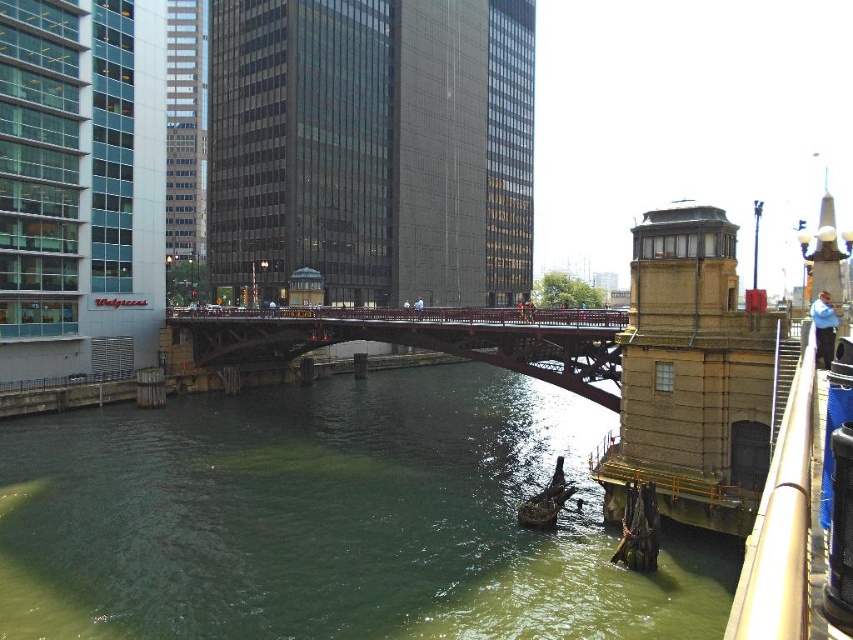
Between green murky water at center and rusty metal boat at lower center, which one appears on the right side from the viewer's perspective?

rusty metal boat at lower center is more to the right.

The image size is (853, 640). Describe the element at coordinates (329, 518) in the screenshot. I see `green murky water at center` at that location.

Is point (422, 432) closer to camera compared to point (525, 525)?

That is False.

Locate an element on the screen. Image resolution: width=853 pixels, height=640 pixels. green murky water at center is located at coordinates (329, 518).

Between red painted steel bridge at center and rusty metal boat at lower center, which one has more height?

With more height is red painted steel bridge at center.

From the picture: Between red painted steel bridge at center and rusty metal boat at lower center, which one appears on the left side from the viewer's perspective?

red painted steel bridge at center

The width and height of the screenshot is (853, 640). Describe the element at coordinates (422, 339) in the screenshot. I see `red painted steel bridge at center` at that location.

Locate an element on the screen. This screenshot has width=853, height=640. red painted steel bridge at center is located at coordinates [422, 339].

Does green murky water at center appear over red painted steel bridge at center?

No, green murky water at center is not above red painted steel bridge at center.

Can you confirm if green murky water at center is positioned to the right of red painted steel bridge at center?

Incorrect, green murky water at center is not on the right side of red painted steel bridge at center.

Between point (273, 390) and point (587, 378), which one is positioned in front?

Positioned in front is point (587, 378).

Locate an element on the screen. The image size is (853, 640). green murky water at center is located at coordinates (329, 518).